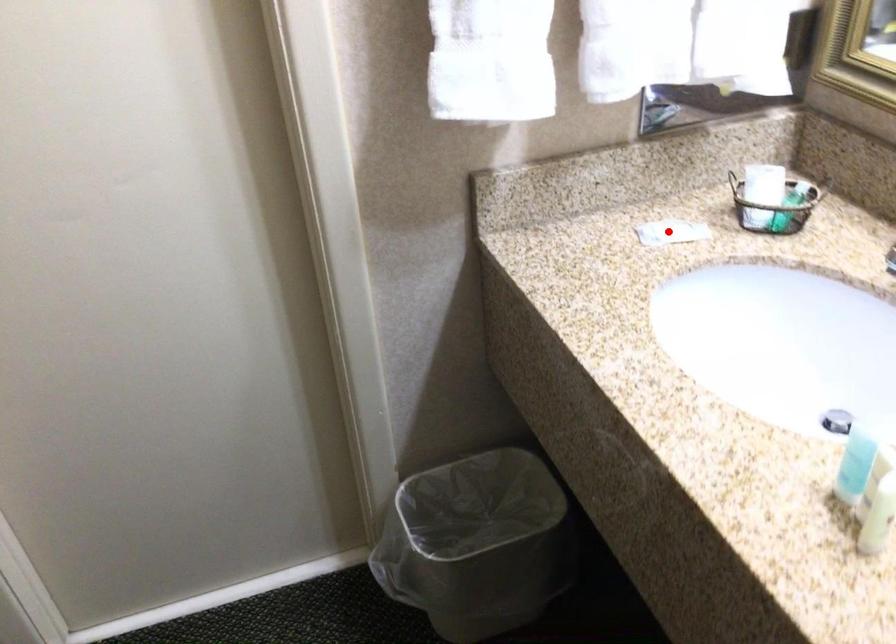
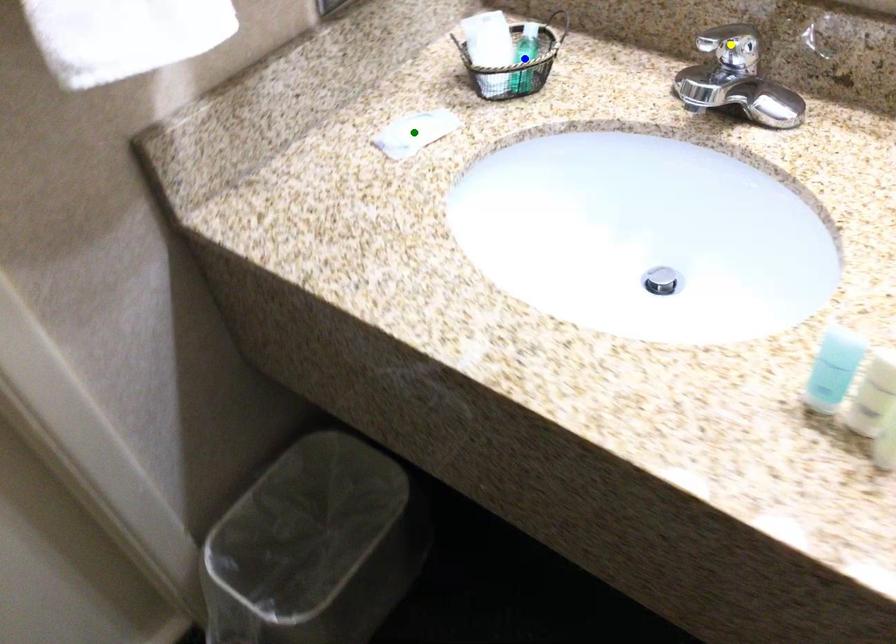
Question: I am providing you with two images of the same scene from different viewpoints. A red point is marked on the first image. You are given multiple points on the second image. In image 2, which mark is for the same physical point as the one in image 1?

Choices:
 (A) green point
 (B) blue point
 (C) yellow point

Answer: (A)